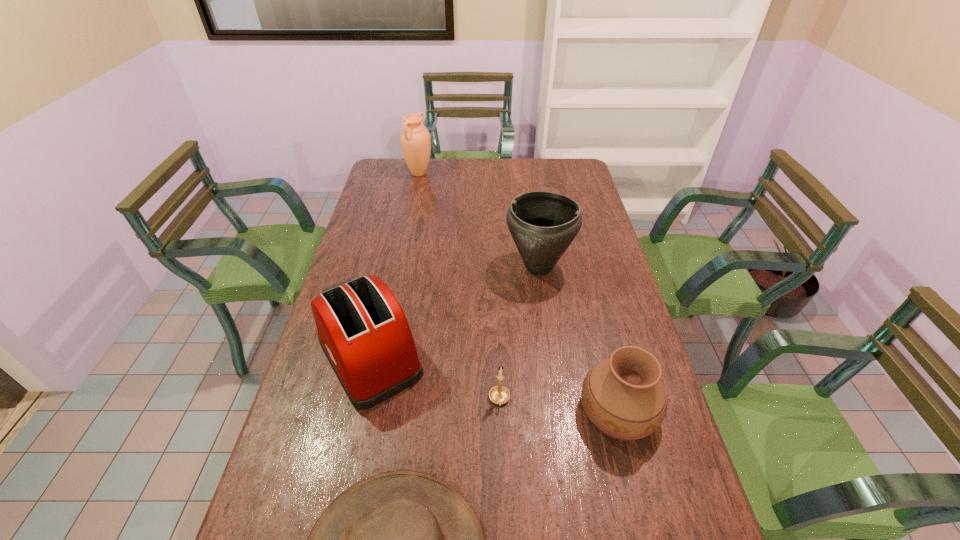
Locate an element on the screen. unoccupied area between the third shortest object and the farthest object is located at coordinates (518, 292).

At what (x,y) coordinates should I click in order to perform the action: click on free point between the second nearest urn and the toaster. Please return your answer as a coordinate pair (x, y). Looking at the image, I should click on tap(454, 312).

Find the location of `free spot between the second farthest urn and the third shortest object`. free spot between the second farthest urn and the third shortest object is located at coordinates (579, 338).

Locate an element on the screen. Image resolution: width=960 pixels, height=540 pixels. unoccupied area between the second farthest object and the shortest urn is located at coordinates (579, 338).

Where is `vacant area that lies between the fourth object from left to right and the farthest urn`? Image resolution: width=960 pixels, height=540 pixels. vacant area that lies between the fourth object from left to right and the farthest urn is located at coordinates (459, 286).

Where is `empty location between the fifth nearest object and the second shortest object`? empty location between the fifth nearest object and the second shortest object is located at coordinates (519, 333).

Identify which object is the third nearest to the fourth object from left to right. Please provide its 2D coordinates. Your answer should be formatted as a tuple, i.e. [(x, y)], where the tuple contains the x and y coordinates of a point satisfying the conditions above.

[(362, 329)]

Locate an element on the screen. The width and height of the screenshot is (960, 540). object that stands as the second closest to the leftmost urn is located at coordinates (x=362, y=329).

Identify which urn is the nearest to the fifth tallest object. Please provide its 2D coordinates. Your answer should be formatted as a tuple, i.e. [(x, y)], where the tuple contains the x and y coordinates of a point satisfying the conditions above.

[(623, 396)]

At what (x,y) coordinates should I click in order to perform the action: click on urn that stands as the third closest to the fourth object from left to right. Please return your answer as a coordinate pair (x, y). This screenshot has height=540, width=960. Looking at the image, I should click on (415, 140).